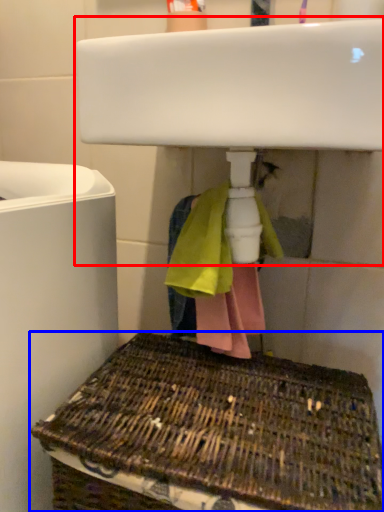
Question: Which object is further to the camera taking this photo, sink (highlighted by a red box) or basket (highlighted by a blue box)?

Choices:
 (A) sink
 (B) basket

Answer: (A)